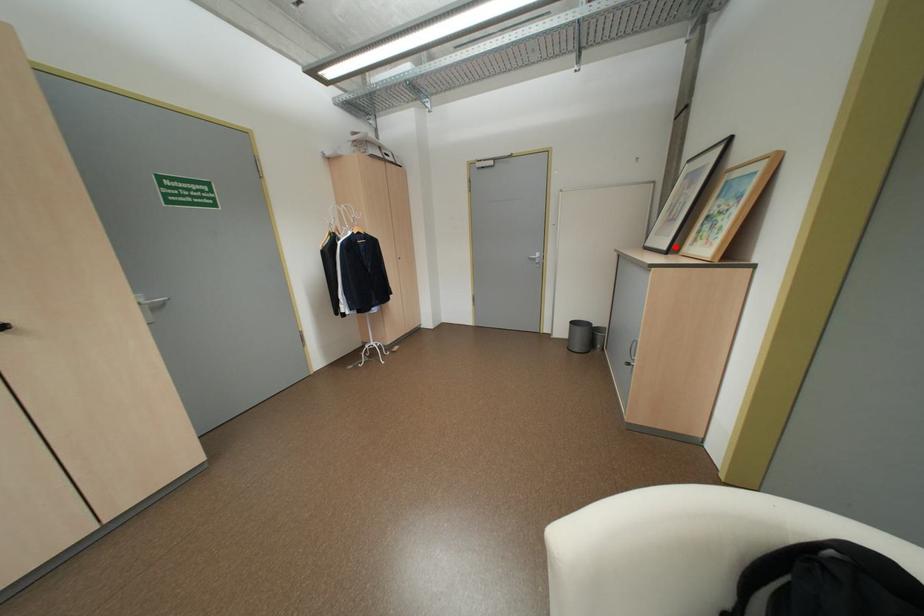
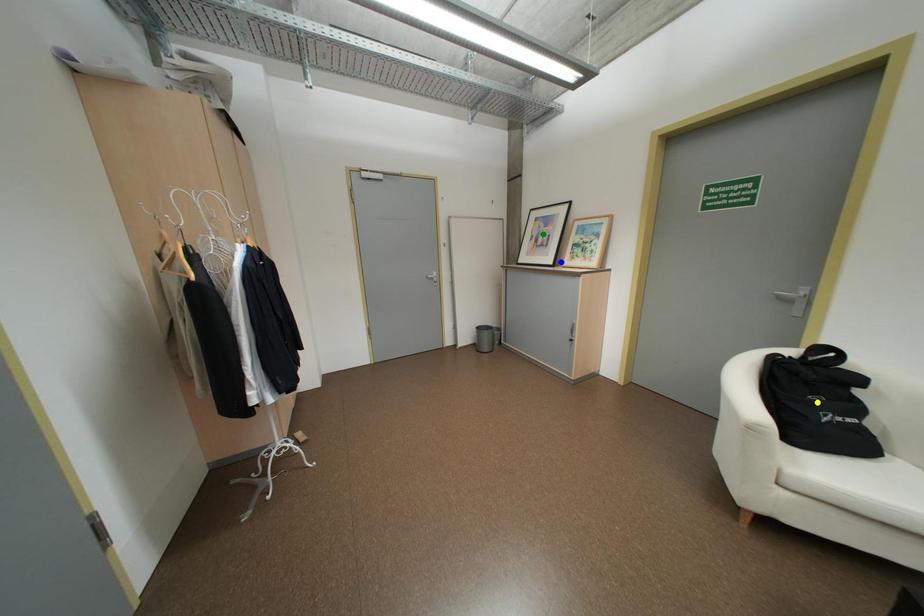
Question: I am providing you with two images of the same scene from different viewpoints. A red point is marked on the first image. You are given multiple points on the second image. Which mark in image 2 goes with the point in image 1?

Choices:
 (A) blue point
 (B) yellow point
 (C) green point

Answer: (A)